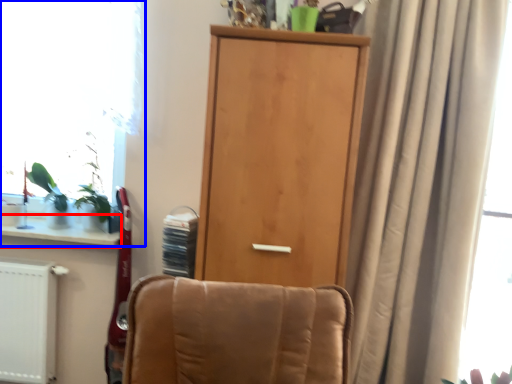
Question: Which of the following is the closest to the observer, window sill (highlighted by a red box) or window (highlighted by a blue box)?

Choices:
 (A) window sill
 (B) window

Answer: (A)